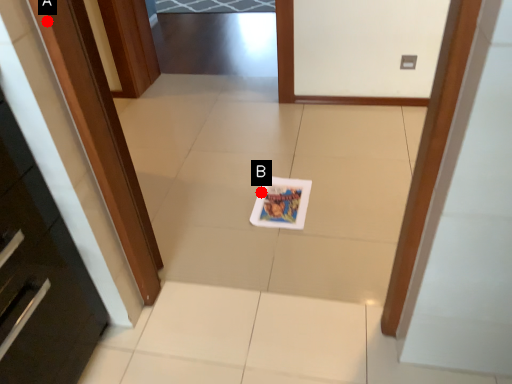
Question: Two points are circled on the image, labeled by A and B beside each circle. Which point is closer to the camera?

Choices:
 (A) A is closer
 (B) B is closer

Answer: (A)